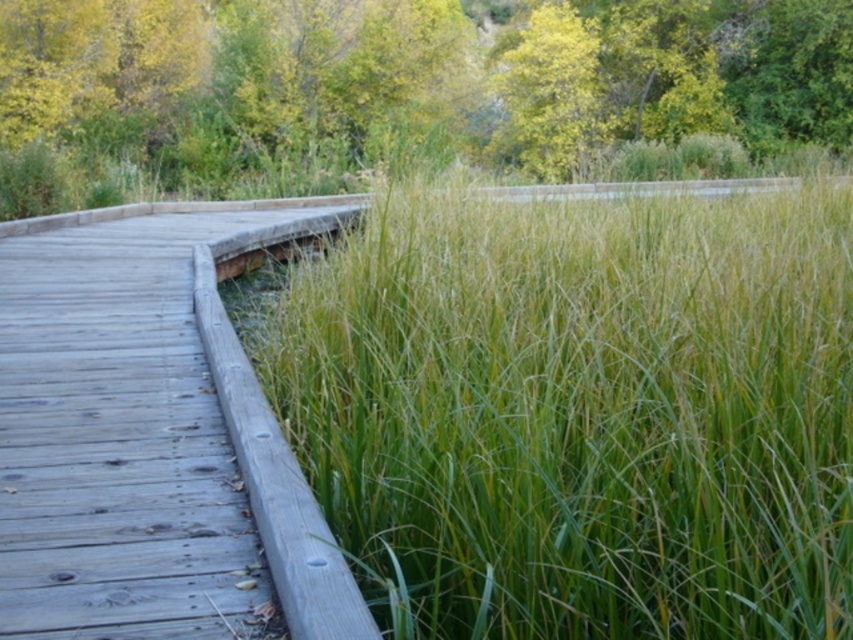
Question: Is green leafy tree at upper center wider than weathered wood path at left?

Choices:
 (A) yes
 (B) no

Answer: (A)

Question: Which of the following is the farthest from the observer?

Choices:
 (A) (54, 192)
 (B) (340, 589)

Answer: (A)

Question: Can you confirm if green leafy tree at upper center is bigger than weathered wood path at left?

Choices:
 (A) yes
 (B) no

Answer: (A)

Question: Is green leafy tree at upper center behind weathered wood path at left?

Choices:
 (A) no
 (B) yes

Answer: (B)

Question: Estimate the real-world distances between objects in this image. Which object is farther from the green grass at center?

Choices:
 (A) green leafy tree at upper center
 (B) weathered wood path at left

Answer: (A)

Question: Estimate the real-world distances between objects in this image. Which object is closer to the green leafy tree at upper center?

Choices:
 (A) weathered wood path at left
 (B) green grass at center

Answer: (A)